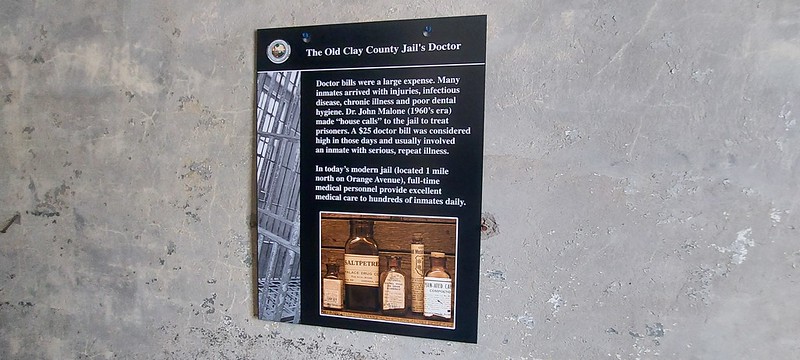
You are a GUI agent. You are given a task and a screenshot of the screen. Output one action in this format:
    pyautogui.click(x=<x>, y=<y>)
    Task: Click on the cement wall right of placard
    
    Given the screenshot: What is the action you would take?
    pyautogui.click(x=581, y=130)